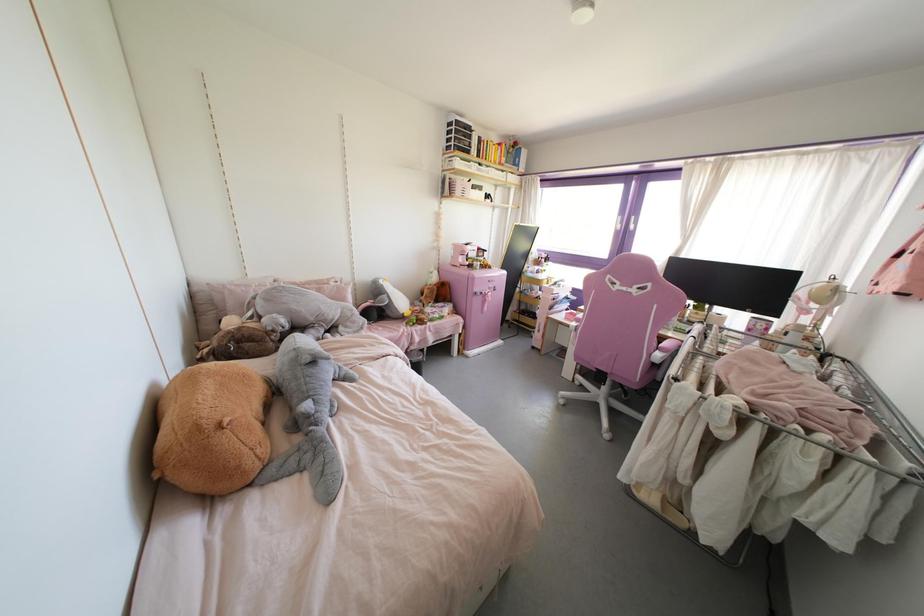
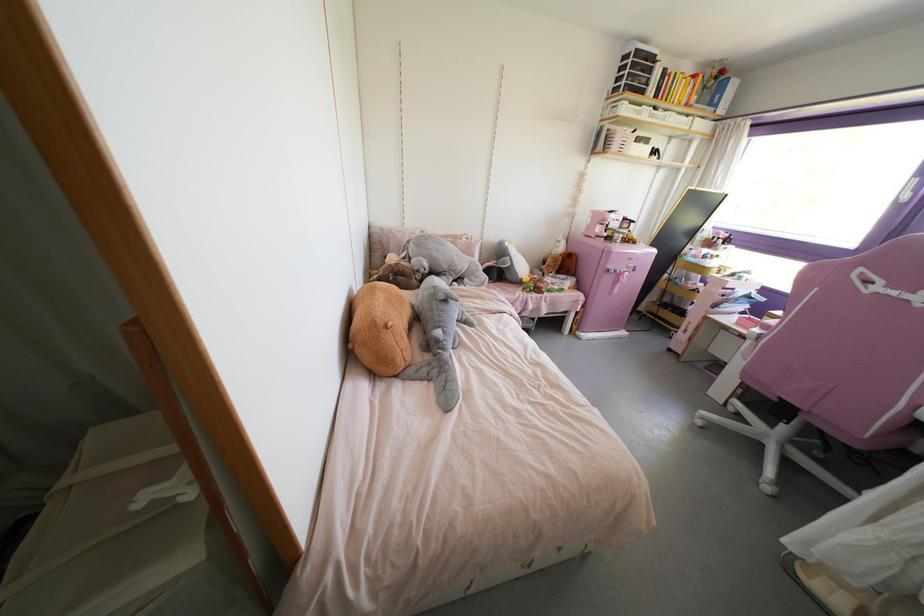
Where in the second image is the point corresponding to point 310,350 from the first image?

(444, 290)